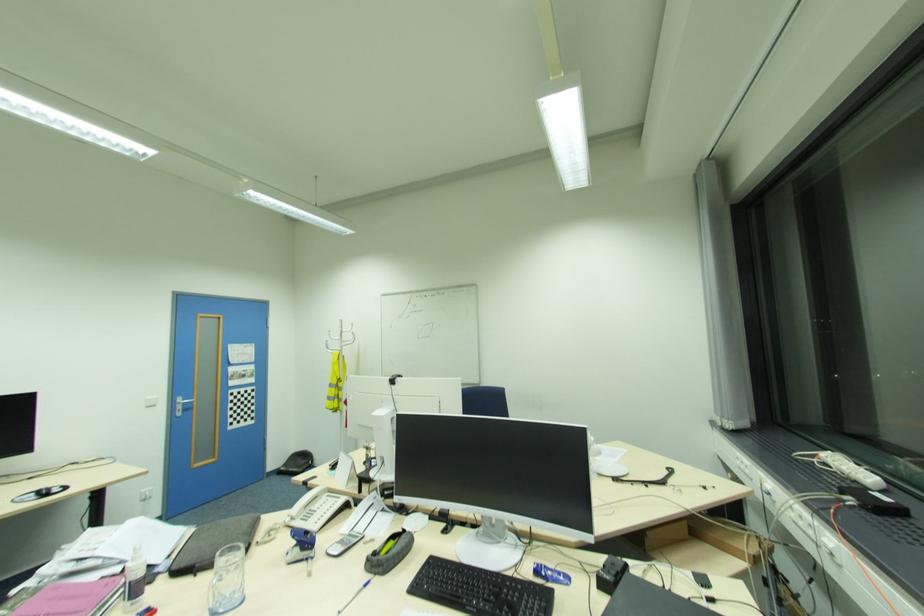
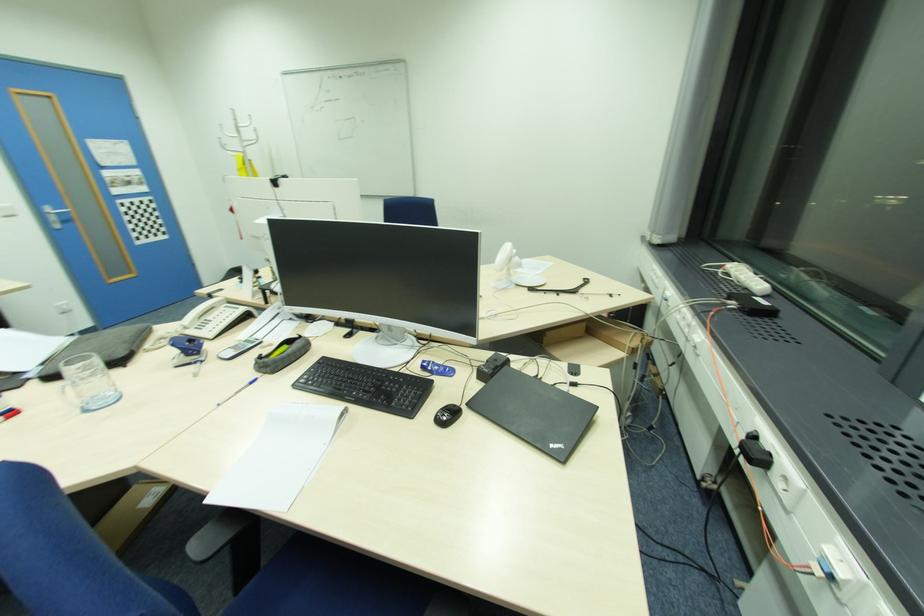
Locate, in the second image, the point that corresponds to pixel 629 573 in the first image.

(508, 367)